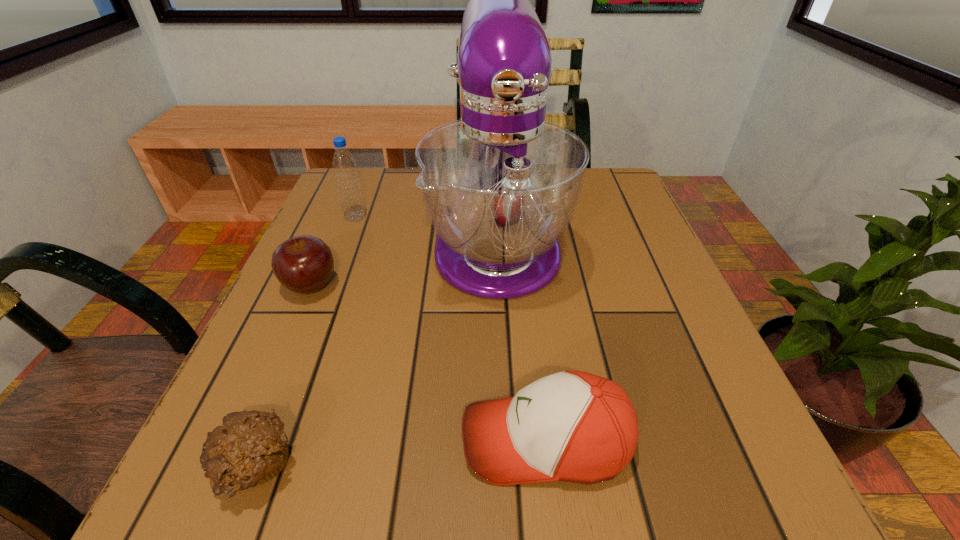
Identify the location of vacant space situated on the front of the apple. This screenshot has width=960, height=540. (278, 360).

The height and width of the screenshot is (540, 960). Identify the location of free space located on the back of the muffin. (291, 376).

The image size is (960, 540). Identify the location of mixer that is at the far edge. (501, 185).

Locate an element on the screen. This screenshot has width=960, height=540. water bottle present at the far edge is located at coordinates (344, 165).

The image size is (960, 540). Find the location of `baseball cap present at the near edge`. baseball cap present at the near edge is located at coordinates (572, 426).

Locate an element on the screen. The width and height of the screenshot is (960, 540). muffin that is at the near edge is located at coordinates (250, 449).

I want to click on water bottle positioned at the left edge, so click(x=344, y=165).

Image resolution: width=960 pixels, height=540 pixels. What are the coordinates of `apple that is at the left edge` in the screenshot? It's located at (303, 264).

At what (x,y) coordinates should I click in order to perform the action: click on muffin that is at the left edge. Please return your answer as a coordinate pair (x, y). The image size is (960, 540). Looking at the image, I should click on coord(250,449).

Find the location of a particular element. The width and height of the screenshot is (960, 540). object that is positioned at the far left corner is located at coordinates (344, 165).